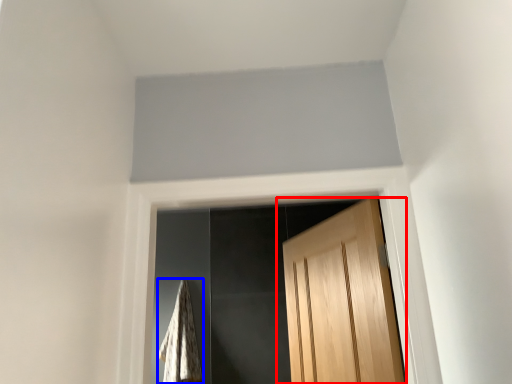
Question: Among these objects, which one is farthest to the camera, door (highlighted by a red box) or blanket (highlighted by a blue box)?

Choices:
 (A) door
 (B) blanket

Answer: (B)